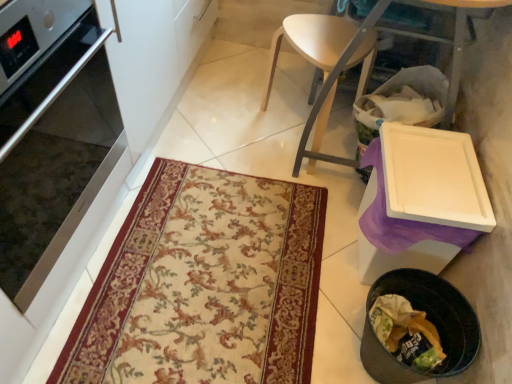
Where is `vacant space to the left of black plastic trash can at lower right`? The width and height of the screenshot is (512, 384). vacant space to the left of black plastic trash can at lower right is located at coordinates (303, 328).